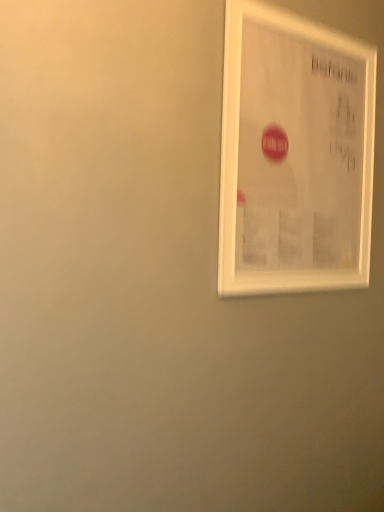
This screenshot has height=512, width=384. What are the coordinates of `white matte picture frame at upper right` in the screenshot? It's located at (295, 153).

What is the approximate width of white matte picture frame at upper right?

white matte picture frame at upper right is 1.21 inches in width.

This screenshot has width=384, height=512. What do you see at coordinates (295, 153) in the screenshot?
I see `white matte picture frame at upper right` at bounding box center [295, 153].

Where is `white matte picture frame at upper right`? The height and width of the screenshot is (512, 384). white matte picture frame at upper right is located at coordinates (295, 153).